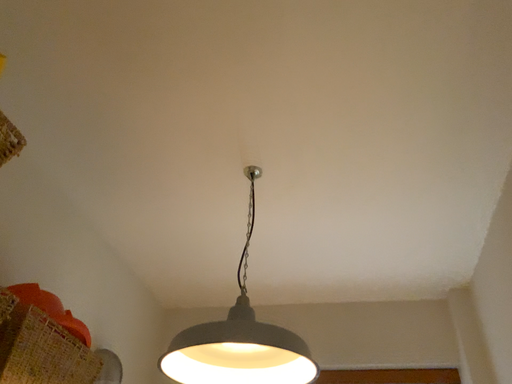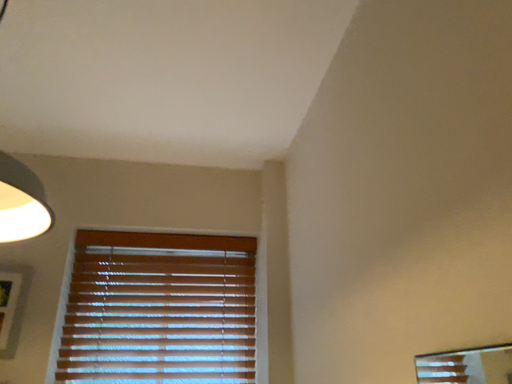
Question: Which way did the camera rotate in the video?

Choices:
 (A) rotated downward
 (B) rotated upward

Answer: (A)